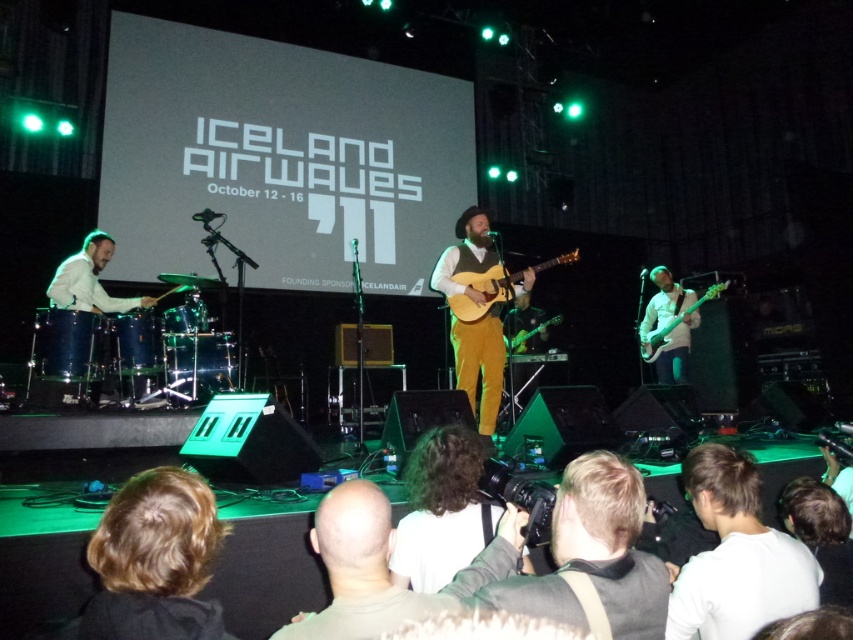
You are a photographer at the Iceland Airwaves festival. You need to capture a photo where the blonde hair at lower left and the bald head at center are both visible. Based on their heights, which one might you need to adjust your camera angle to include in the frame?

The blonde hair at lower left is taller than the bald head at center, so you might need to adjust your camera angle to account for the height difference to ensure both are visible.

You are a photographer at the Iceland Airwaves festival and want to take a photo of the drummer and the guitarist. There is a gray fabric camera at center. Where should you position the camera to capture both the drummer and the guitarist in the frame?

The gray fabric camera at center is located at point (x=579, y=556), so positioning it there would allow you to capture both the drummer and the guitarist in the frame.

You are a photographer taking a picture of the stage at the Iceland Airwaves festival. You notice two points marked on the stage. The first point is at coordinate point (146, 547) and the second is at point (401, 598). Which point will appear larger in your photo?

Point (146, 547) is closer to the camera than point (401, 598), so it will appear larger in the photo.